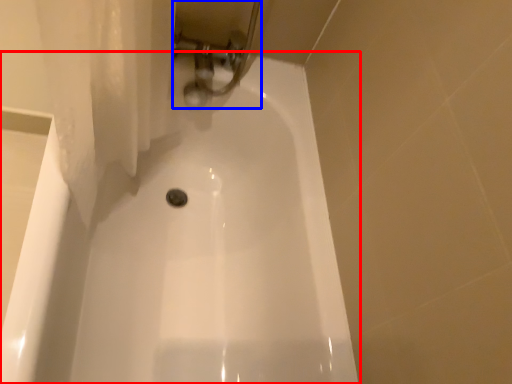
Question: Which point is further to the camera, bathtub (highlighted by a red box) or plumbing fixture (highlighted by a blue box)?

Choices:
 (A) bathtub
 (B) plumbing fixture

Answer: (B)